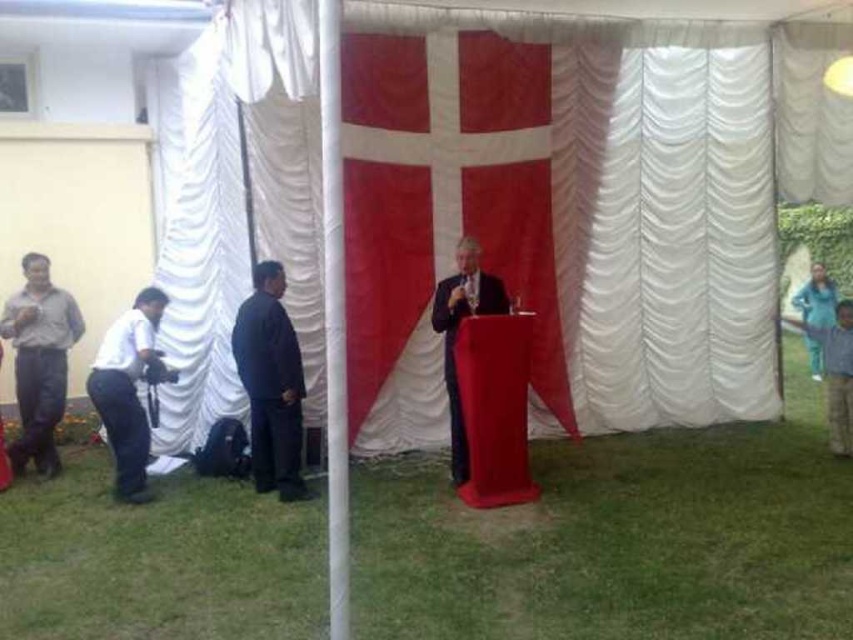
Question: Is blue denim jacket at right smaller than blue fabric at right?

Choices:
 (A) yes
 (B) no

Answer: (A)

Question: Which point is closer to the camera?

Choices:
 (A) dark suit at center
 (B) blue denim jacket at right
 (C) dark blue suit at center
 (D) blue fabric at right

Answer: (A)

Question: Is matte red podium at center further to the viewer compared to gray matte pants at left?

Choices:
 (A) no
 (B) yes

Answer: (A)

Question: Which object is positioned closest to the matte red podium at center?

Choices:
 (A) dark blue suit at center
 (B) gray matte pants at left

Answer: (A)

Question: Which object is positioned closest to the dark blue suit at center?

Choices:
 (A) white satin curtain at center
 (B) matte red podium at center

Answer: (B)

Question: Is white satin curtain at center positioned before matte red podium at center?

Choices:
 (A) no
 (B) yes

Answer: (A)